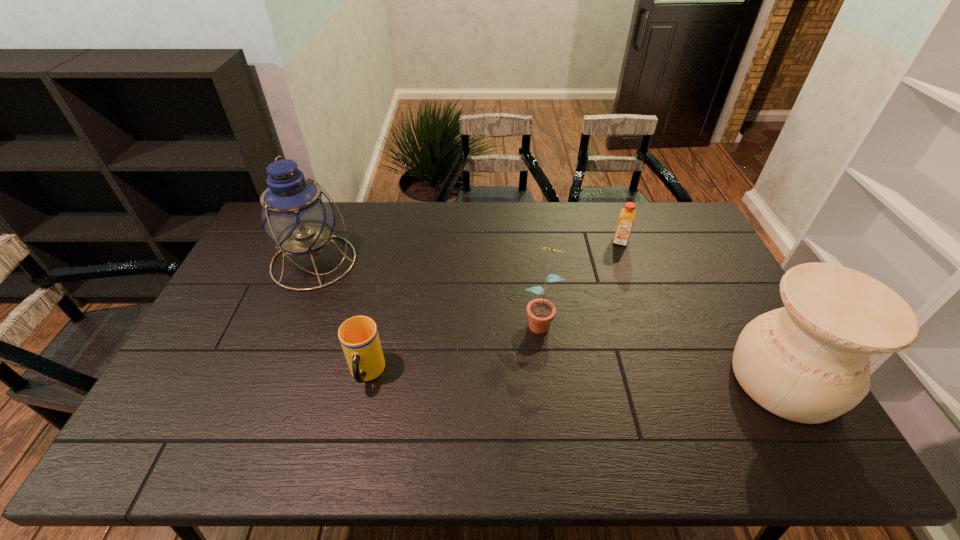
In order to click on cup in this screenshot , I will do `click(359, 338)`.

The width and height of the screenshot is (960, 540). What are the coordinates of `pottery` in the screenshot? It's located at (809, 362).

Where is `the second object from right to left`? The image size is (960, 540). the second object from right to left is located at coordinates (626, 219).

This screenshot has width=960, height=540. In order to click on lantern in this screenshot , I will do `click(296, 214)`.

This screenshot has width=960, height=540. I want to click on the tallest object, so click(x=296, y=214).

The width and height of the screenshot is (960, 540). Identify the location of the third object from left to right. (541, 312).

This screenshot has width=960, height=540. I want to click on sunflower, so click(x=541, y=312).

This screenshot has height=540, width=960. What are the coordinates of `vacant space positioned 0.170m on the front and back of the second object from right to left` in the screenshot? It's located at (615, 279).

Locate an element on the screen. This screenshot has width=960, height=540. vacant space located on the front and back of the second object from right to left is located at coordinates (617, 267).

The image size is (960, 540). What are the coordinates of `vacant space positioned on the front and back of the second object from right to left` in the screenshot? It's located at (610, 329).